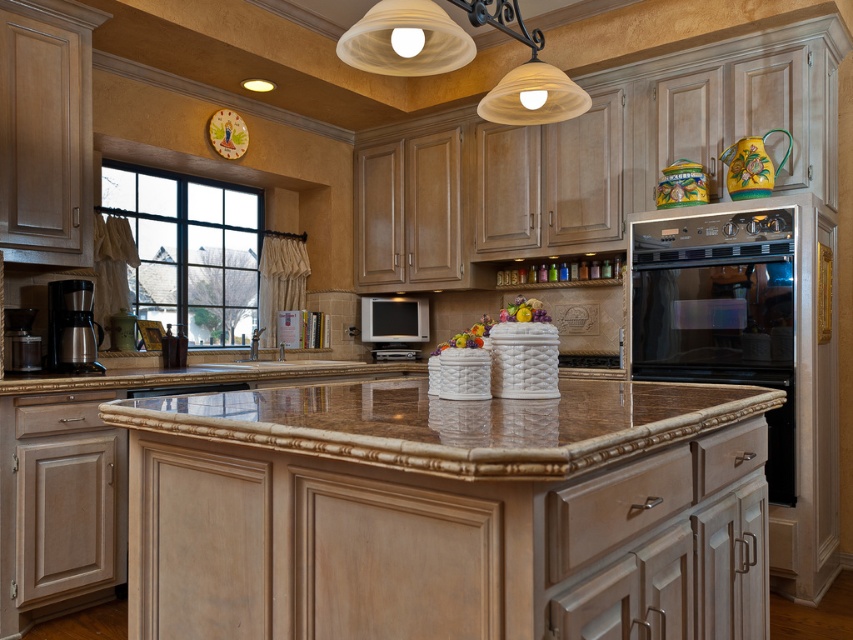
Question: Is brown granite countertop at center further to the viewer compared to satin silver oven at right?

Choices:
 (A) yes
 (B) no

Answer: (B)

Question: Which point is closer to the camera taking this photo?

Choices:
 (A) (728, 320)
 (B) (76, 353)
 (C) (477, 458)

Answer: (C)

Question: Which object is farther from the camera taking this photo?

Choices:
 (A) brown granite countertop at center
 (B) satin silver oven at right
 (C) satin silver coffee maker at left

Answer: (C)

Question: Is brown granite countertop at center wider than satin silver coffee maker at left?

Choices:
 (A) no
 (B) yes

Answer: (B)

Question: Which point is closer to the camera taking this photo?

Choices:
 (A) (648, 268)
 (B) (764, 397)
 (C) (70, 340)

Answer: (B)

Question: Does satin silver oven at right appear on the right side of satin silver coffee maker at left?

Choices:
 (A) yes
 (B) no

Answer: (A)